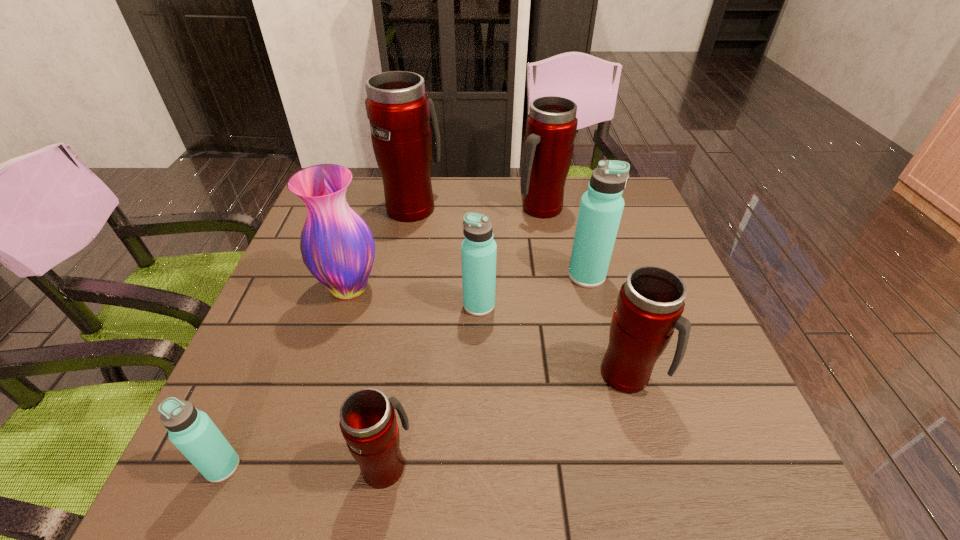
Where is `vacant space located on the side with the handle of the nearest red thermos bottle`? vacant space located on the side with the handle of the nearest red thermos bottle is located at coordinates (407, 332).

The height and width of the screenshot is (540, 960). I want to click on free space located 0.050m on the side with the handle of the nearest red thermos bottle, so click(x=394, y=413).

Find the location of a particular element. free space located 0.050m on the right of the nearest aqua thermos bottle is located at coordinates (269, 467).

Identify the location of vase at the left edge. (337, 246).

I want to click on thermos bottle situated at the left edge, so click(192, 431).

This screenshot has height=540, width=960. I want to click on object present at the right edge, so click(650, 303).

Identify the location of object present at the near left corner. This screenshot has width=960, height=540. (192, 431).

Locate an element on the screen. This screenshot has height=540, width=960. free space at the far edge of the desktop is located at coordinates (517, 212).

The width and height of the screenshot is (960, 540). In the image, there is a desktop. Identify the location of vacant space at the near edge. (459, 475).

This screenshot has width=960, height=540. Find the location of `vacant space at the left edge of the desktop`. vacant space at the left edge of the desktop is located at coordinates (264, 391).